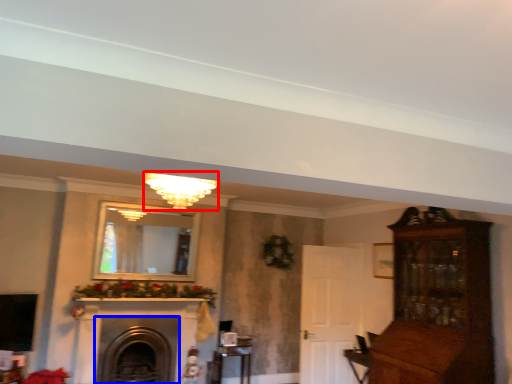
Question: Among these objects, which one is farthest to the camera, light fixture (highlighted by a red box) or fireplace (highlighted by a blue box)?

Choices:
 (A) light fixture
 (B) fireplace

Answer: (B)